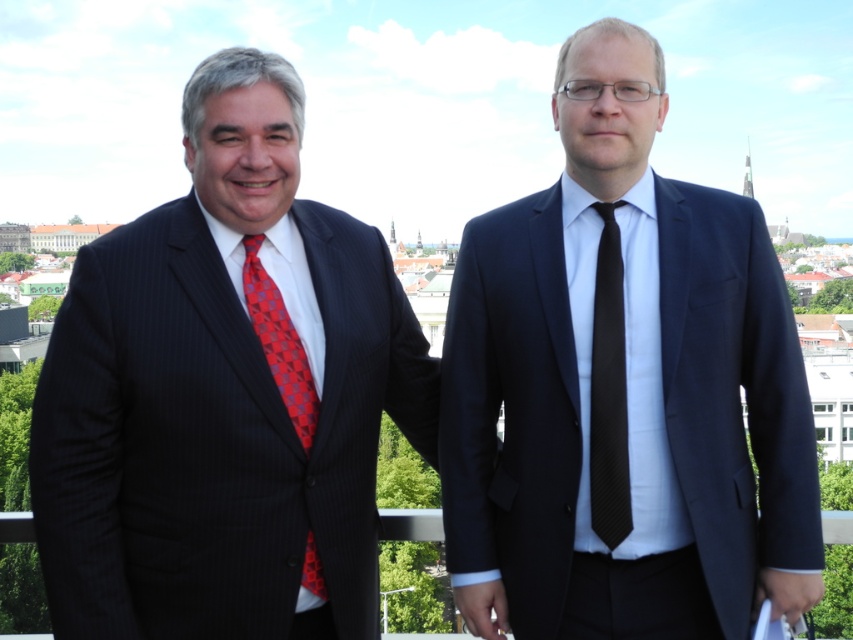
Question: Is matte black suit at right positioned in front of black textured tie at center?

Choices:
 (A) no
 (B) yes

Answer: (B)

Question: Can you confirm if matte black suit at right is bigger than matte black suit at left?

Choices:
 (A) no
 (B) yes

Answer: (A)

Question: Estimate the real-world distances between objects in this image. Which object is farther from the matte black suit at right?

Choices:
 (A) black textured tie at center
 (B) matte black suit at left

Answer: (B)

Question: Can you confirm if matte black suit at right is thinner than black textured tie at center?

Choices:
 (A) no
 (B) yes

Answer: (A)

Question: Which point appears closest to the camera in this image?

Choices:
 (A) (248, 580)
 (B) (309, 438)
 (C) (598, 477)
 (D) (801, 525)

Answer: (A)

Question: Based on their relative distances, which object is farther from the matte black suit at left?

Choices:
 (A) black textured tie at center
 (B) matte black suit at right

Answer: (A)